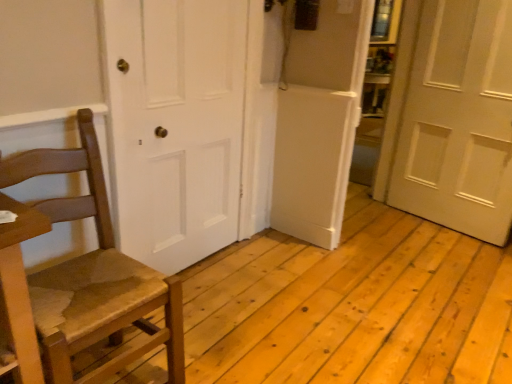
Locate an element on the screen. white matte door at center, which is counted as the 1th door, starting from the left is located at coordinates coord(176,125).

Describe the element at coordinates (458, 120) in the screenshot. This screenshot has width=512, height=384. I see `white matte door at right, the second door in the left-to-right sequence` at that location.

This screenshot has width=512, height=384. Find the location of `white matte door at center, which is counted as the 1th door, starting from the left`. white matte door at center, which is counted as the 1th door, starting from the left is located at coordinates (176, 125).

Would you say white matte door at right, the second door in the left-to-right sequence, is to the left or to the right of wooden chair at left in the picture?

From the image, it's evident that white matte door at right, the second door in the left-to-right sequence, is to the right of wooden chair at left.

Where is `chair in front of the white matte door at right, the second door in the left-to-right sequence`? chair in front of the white matte door at right, the second door in the left-to-right sequence is located at coordinates (93, 275).

From a real-world perspective, between white matte door at right, positioned as the first door in right-to-left order, and wooden chair at left, who is vertically higher?

white matte door at right, positioned as the first door in right-to-left order, is physically above.

Is white matte door at right, positioned as the first door in right-to-left order, touching wooden chair at left?

white matte door at right, positioned as the first door in right-to-left order, is not next to wooden chair at left, and they're not touching.

Which is closer to the camera, (226, 185) or (62, 378)?

Point (62, 378)

Considering the relative sizes of white matte door at center, which is counted as the 1th door, starting from the left, and wooden chair at left in the image provided, is white matte door at center, which is counted as the 1th door, starting from the left, smaller than wooden chair at left?

Correct, white matte door at center, which is counted as the 1th door, starting from the left, occupies less space than wooden chair at left.

Is white matte door at center, which is counted as the 1th door, starting from the left, taller than wooden chair at left?

Indeed, white matte door at center, which is counted as the 1th door, starting from the left, has a greater height compared to wooden chair at left.

From the image's perspective, is white matte door at center, which is counted as the 1th door, starting from the left, above wooden chair at left?

Indeed, from the image's perspective, white matte door at center, which is counted as the 1th door, starting from the left, is shown above wooden chair at left.

From the picture: Is wooden chair at left not inside white matte door at right, the second door in the left-to-right sequence?

Yes, wooden chair at left is outside of white matte door at right, the second door in the left-to-right sequence.

From a real-world perspective, does wooden chair at left stand above white matte door at right, the second door in the left-to-right sequence?

No, from a real-world perspective, wooden chair at left is not over white matte door at right, the second door in the left-to-right sequence

Is point (39, 308) positioned behind point (436, 147)?

No, it is not.

Is wooden chair at left smaller than white matte door at right, the second door in the left-to-right sequence?

No.

Can you confirm if white matte door at right, the second door in the left-to-right sequence, is smaller than white matte door at center, which ranks as the 2th door in right-to-left order?

No, white matte door at right, the second door in the left-to-right sequence, is not smaller than white matte door at center, which ranks as the 2th door in right-to-left order.

Can you tell me how much white matte door at right, the second door in the left-to-right sequence, and white matte door at center, which ranks as the 2th door in right-to-left order, differ in facing direction?

They differ by 101 degrees in their facing directions.

Considering the positions of objects white matte door at right, the second door in the left-to-right sequence, and white matte door at center, which is counted as the 1th door, starting from the left, in the image provided, who is in front, white matte door at right, the second door in the left-to-right sequence, or white matte door at center, which is counted as the 1th door, starting from the left,?

Positioned in front is white matte door at center, which is counted as the 1th door, starting from the left.

Where is `door lying above the white matte door at center, which ranks as the 2th door in right-to-left order (from the image's perspective)`? The height and width of the screenshot is (384, 512). door lying above the white matte door at center, which ranks as the 2th door in right-to-left order (from the image's perspective) is located at coordinates (458, 120).

Considering the relative sizes of wooden chair at left and white matte door at center, which ranks as the 2th door in right-to-left order, in the image provided, is wooden chair at left smaller than white matte door at center, which ranks as the 2th door in right-to-left order,?

No, wooden chair at left is not smaller than white matte door at center, which ranks as the 2th door in right-to-left order.

Image resolution: width=512 pixels, height=384 pixels. In order to click on the 1st door above when counting from the wooden chair at left (from the image's perspective) in this screenshot , I will do `click(176, 125)`.

Is point (179, 280) closer to camera compared to point (208, 86)?

Yes, point (179, 280) is in front of point (208, 86).

Is white matte door at center, which ranks as the 2th door in right-to-left order, thinner than white matte door at right, positioned as the first door in right-to-left order?

Indeed, white matte door at center, which ranks as the 2th door in right-to-left order, has a lesser width compared to white matte door at right, positioned as the first door in right-to-left order.

This screenshot has height=384, width=512. What are the coordinates of `door lying on the left of white matte door at right, positioned as the first door in right-to-left order` in the screenshot? It's located at (176, 125).

Is white matte door at center, which ranks as the 2th door in right-to-left order, positioned far away from white matte door at right, the second door in the left-to-right sequence?

Yes, white matte door at center, which ranks as the 2th door in right-to-left order, and white matte door at right, the second door in the left-to-right sequence, are quite far apart.

Measure the distance from white matte door at center, which ranks as the 2th door in right-to-left order, to white matte door at right, positioned as the first door in right-to-left order.

The distance of white matte door at center, which ranks as the 2th door in right-to-left order, from white matte door at right, positioned as the first door in right-to-left order, is 1.72 meters.

You are a GUI agent. You are given a task and a screenshot of the screen. Output one action in this format:
    pyautogui.click(x=<x>, y=<y>)
    Task: Click on the chair that is in front of the white matte door at right, the second door in the left-to-right sequence
    
    Given the screenshot: What is the action you would take?
    pyautogui.click(x=93, y=275)

Locate an element on the screen. The image size is (512, 384). the 1st door counting from the right side of the wooden chair at left is located at coordinates (176, 125).

When comparing their distances from white matte door at right, positioned as the first door in right-to-left order, does white matte door at center, which ranks as the 2th door in right-to-left order, or wooden chair at left seem further?

wooden chair at left is positioned further to the anchor white matte door at right, positioned as the first door in right-to-left order.

Estimate the real-world distances between objects in this image. Which object is closer to white matte door at center, which ranks as the 2th door in right-to-left order, white matte door at right, positioned as the first door in right-to-left order, or wooden chair at left?

wooden chair at left is closer to white matte door at center, which ranks as the 2th door in right-to-left order.

When comparing their distances from white matte door at right, positioned as the first door in right-to-left order, does wooden chair at left or white matte door at center, which ranks as the 2th door in right-to-left order, seem further?

wooden chair at left lies further to white matte door at right, positioned as the first door in right-to-left order, than the other object.

Looking at the image, which one is located further to white matte door at center, which ranks as the 2th door in right-to-left order, wooden chair at left or white matte door at right, positioned as the first door in right-to-left order?

white matte door at right, positioned as the first door in right-to-left order.

Based on the photo, looking at the image, which one is located closer to wooden chair at left, white matte door at center, which is counted as the 1th door, starting from the left, or white matte door at right, positioned as the first door in right-to-left order?

white matte door at center, which is counted as the 1th door, starting from the left, lies closer to wooden chair at left than the other object.

From the picture: Considering their positions, is white matte door at right, positioned as the first door in right-to-left order, positioned further to wooden chair at left than white matte door at center, which is counted as the 1th door, starting from the left?

Based on the image, white matte door at right, positioned as the first door in right-to-left order, appears to be further to wooden chair at left.

Identify the location of door between wooden chair at left and white matte door at right, the second door in the left-to-right sequence, from left to right. The width and height of the screenshot is (512, 384). (176, 125).